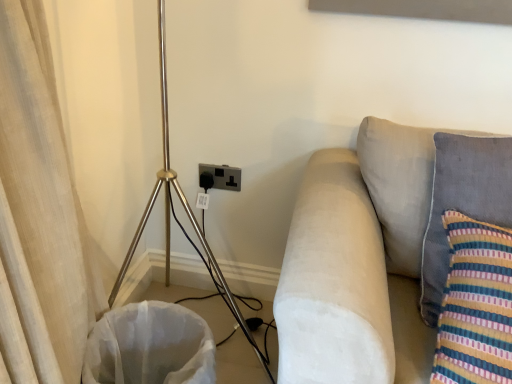
Question: Can velvety gray pillow at right be found inside suede beige couch at right?

Choices:
 (A) yes
 (B) no

Answer: (A)

Question: From the image's perspective, is suede beige couch at right under velvety gray pillow at right?

Choices:
 (A) no
 (B) yes

Answer: (B)

Question: From the image's perspective, is suede beige couch at right located above velvety gray pillow at right?

Choices:
 (A) yes
 (B) no

Answer: (B)

Question: Is the depth of suede beige couch at right less than that of velvety gray pillow at right?

Choices:
 (A) yes
 (B) no

Answer: (A)

Question: From a real-world perspective, is suede beige couch at right physically below velvety gray pillow at right?

Choices:
 (A) yes
 (B) no

Answer: (A)

Question: From a real-world perspective, relative to white fabric laundry basket at lower left, is velvety gray pillow at right vertically above or below?

Choices:
 (A) below
 (B) above

Answer: (B)

Question: In terms of height, does velvety gray pillow at right look taller or shorter compared to white fabric laundry basket at lower left?

Choices:
 (A) short
 (B) tall

Answer: (B)

Question: Is velvety gray pillow at right to the left or to the right of white fabric laundry basket at lower left in the image?

Choices:
 (A) left
 (B) right

Answer: (B)

Question: Considering the positions of velvety gray pillow at right and white fabric laundry basket at lower left in the image, is velvety gray pillow at right bigger or smaller than white fabric laundry basket at lower left?

Choices:
 (A) small
 (B) big

Answer: (A)

Question: Considering the positions of polished brass tripod at left and black plastic electric outlet at lower center in the image, is polished brass tripod at left bigger or smaller than black plastic electric outlet at lower center?

Choices:
 (A) small
 (B) big

Answer: (B)

Question: In terms of height, does polished brass tripod at left look taller or shorter compared to black plastic electric outlet at lower center?

Choices:
 (A) tall
 (B) short

Answer: (A)

Question: Considering the positions of point (241, 327) and point (222, 188), is point (241, 327) closer or farther from the camera than point (222, 188)?

Choices:
 (A) farther
 (B) closer

Answer: (A)

Question: From a real-world perspective, is polished brass tripod at left above or below black plastic electric outlet at lower center?

Choices:
 (A) above
 (B) below

Answer: (A)

Question: In terms of width, does black plastic electric outlet at lower center look wider or thinner when compared to polished brass tripod at left?

Choices:
 (A) wide
 (B) thin

Answer: (B)

Question: Which is correct: black plastic electric outlet at lower center is inside polished brass tripod at left, or outside of it?

Choices:
 (A) outside
 (B) inside

Answer: (A)